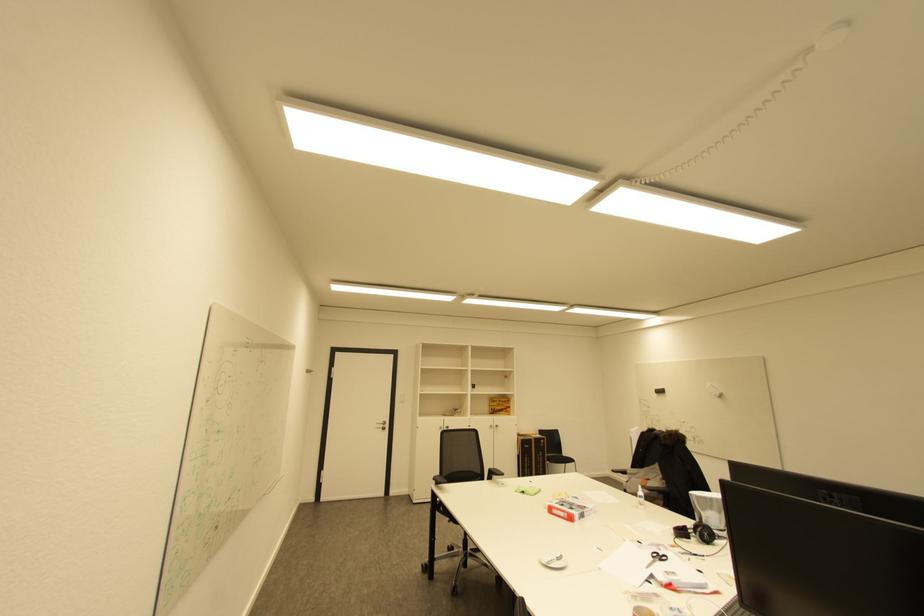
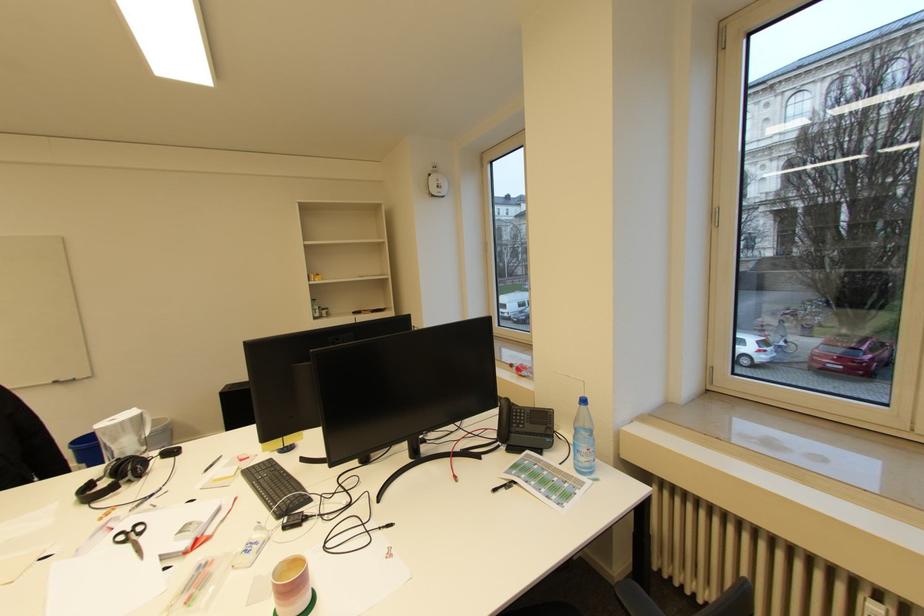
Locate, in the second image, the point that corresponds to point (670, 556) in the first image.

(141, 525)